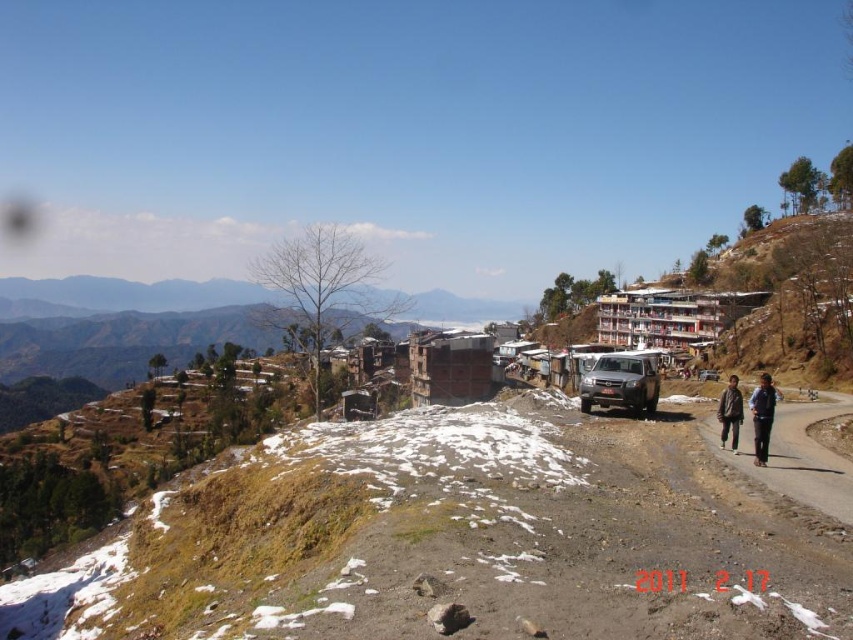
Question: Considering the real-world distances, which object is closest to the dark brown leather jacket at lower right?

Choices:
 (A) brown fabric jacket at lower right
 (B) matte silver jeep at center-right
 (C) dirt road at lower right
 (D) dark blue fabric at right

Answer: (D)

Question: Which object appears closest to the camera in this image?

Choices:
 (A) dark brown leather jacket at lower right
 (B) dirt road at lower right

Answer: (B)

Question: Where is dark brown leather jacket at lower right located in relation to dark blue fabric at right in the image?

Choices:
 (A) below
 (B) above

Answer: (A)

Question: Which object appears closest to the camera in this image?

Choices:
 (A) brown fabric jacket at lower right
 (B) dark blue fabric at right
 (C) dark brown leather jacket at lower right

Answer: (C)

Question: From the image, what is the correct spatial relationship of dirt road at lower right in relation to dark brown leather jacket at lower right?

Choices:
 (A) above
 (B) below

Answer: (B)

Question: Is dark blue fabric at right above brown fabric jacket at lower right?

Choices:
 (A) yes
 (B) no

Answer: (A)